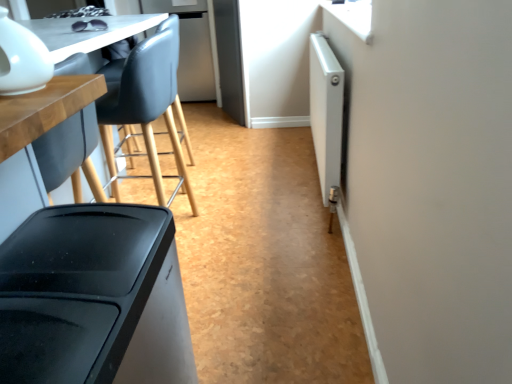
Question: Is white glossy teapot at upper left, marked as the first appliance in a front-to-back arrangement, taller than matte wood table at left?

Choices:
 (A) no
 (B) yes

Answer: (A)

Question: Is white glossy teapot at upper left, the second appliance viewed from the right, smaller than matte wood table at left?

Choices:
 (A) yes
 (B) no

Answer: (A)

Question: From a real-world perspective, is white glossy teapot at upper left, which is counted as the 1th appliance, starting from the left, located beneath matte wood table at left?

Choices:
 (A) no
 (B) yes

Answer: (A)

Question: Can you confirm if white glossy teapot at upper left, the second appliance viewed from the right, is wider than matte wood table at left?

Choices:
 (A) yes
 (B) no

Answer: (B)

Question: Can you confirm if white glossy teapot at upper left, which is the 2th appliance in back-to-front order, is thinner than matte wood table at left?

Choices:
 (A) no
 (B) yes

Answer: (B)

Question: Is white glossy teapot at upper left, the second appliance viewed from the right, oriented towards matte wood table at left?

Choices:
 (A) no
 (B) yes

Answer: (A)

Question: Can you confirm if white metallic radiator at right, placed as the 2th appliance when sorted from front to back, is taller than white glossy teapot at upper left, which is the 2th appliance in back-to-front order?

Choices:
 (A) no
 (B) yes

Answer: (B)

Question: Is white metallic radiator at right, which is the 2th appliance from left to right, touching white glossy teapot at upper left, the second appliance viewed from the right?

Choices:
 (A) no
 (B) yes

Answer: (A)

Question: Considering the relative sizes of white metallic radiator at right, which is the 2th appliance from left to right, and white glossy teapot at upper left, which is the 2th appliance in back-to-front order, in the image provided, is white metallic radiator at right, which is the 2th appliance from left to right, shorter than white glossy teapot at upper left, which is the 2th appliance in back-to-front order,?

Choices:
 (A) yes
 (B) no

Answer: (B)

Question: Is white metallic radiator at right, which is the 2th appliance from left to right, to the left of white glossy teapot at upper left, which is counted as the 1th appliance, starting from the left, from the viewer's perspective?

Choices:
 (A) no
 (B) yes

Answer: (A)

Question: Is white metallic radiator at right, which is the first appliance in right-to-left order, not close to white glossy teapot at upper left, which is the 2th appliance in back-to-front order?

Choices:
 (A) yes
 (B) no

Answer: (A)

Question: From a real-world perspective, does white metallic radiator at right, which is the 2th appliance from left to right, sit lower than white glossy teapot at upper left, the second appliance viewed from the right?

Choices:
 (A) no
 (B) yes

Answer: (B)

Question: From the image's perspective, would you say matte wood table at left is positioned over white glossy teapot at upper left, which is counted as the 1th appliance, starting from the left?

Choices:
 (A) yes
 (B) no

Answer: (B)